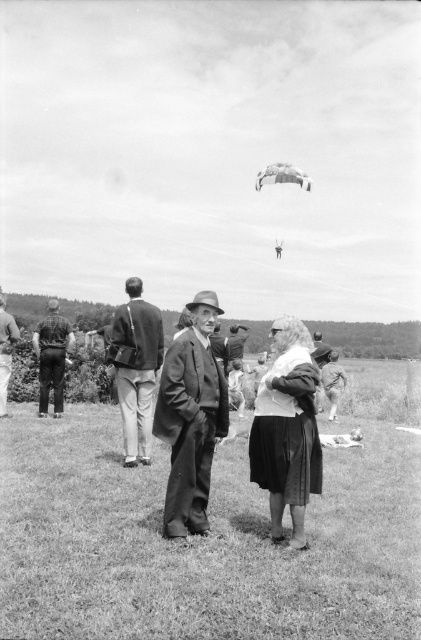
You are an observer standing in the same field as the two central figures. You need to determine the relative positions of the matte fabric skirt at center and the smooth leather jacket at center. Which one is located higher up?

The matte fabric skirt at center is below the smooth leather jacket at center, so the smooth leather jacket at center is higher up.